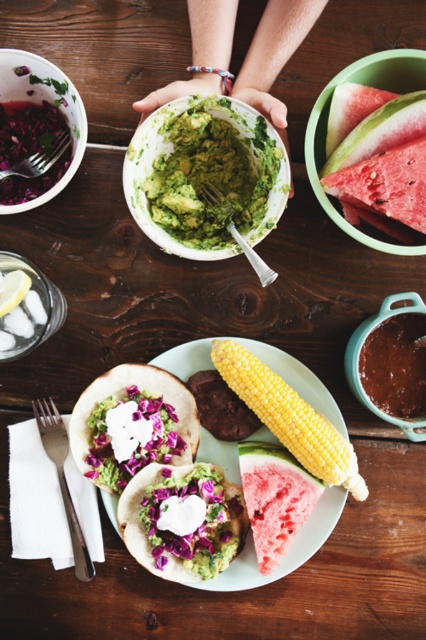
Question: Considering the relative positions of green creamy guacamole at center and green matte bowl at upper right in the image provided, where is green creamy guacamole at center located with respect to green matte bowl at upper right?

Choices:
 (A) below
 (B) above

Answer: (A)

Question: Which point is closer to the camera?

Choices:
 (A) white creamy tortillas at center
 (B) green matte guacamole taco at center
 (C) matte white bowl at upper left

Answer: (C)

Question: Which object is closer to the camera taking this photo?

Choices:
 (A) matte avocado-topped tacos at center
 (B) yellow smooth corn at center
 (C) green matte guacamole bowl at center
 (D) green matte guacamole taco at center

Answer: (C)

Question: Is yellow smooth corn at center below ripe red watermelon at upper right?

Choices:
 (A) yes
 (B) no

Answer: (A)

Question: Is green creamy guacamole at center wider than matte avocado-topped tacos at center?

Choices:
 (A) no
 (B) yes

Answer: (B)

Question: Which point is closer to the camera taking this photo?

Choices:
 (A) (158, 381)
 (B) (310, 481)
 (C) (314, 10)
 (D) (238, 589)

Answer: (C)